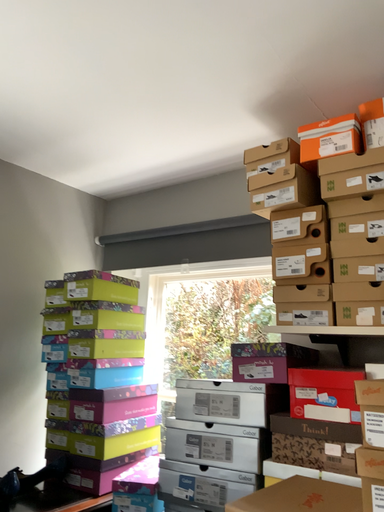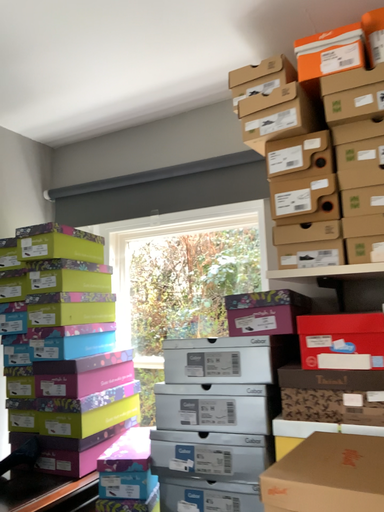
Question: Which way did the camera rotate in the video?

Choices:
 (A) rotated right
 (B) rotated left

Answer: (A)